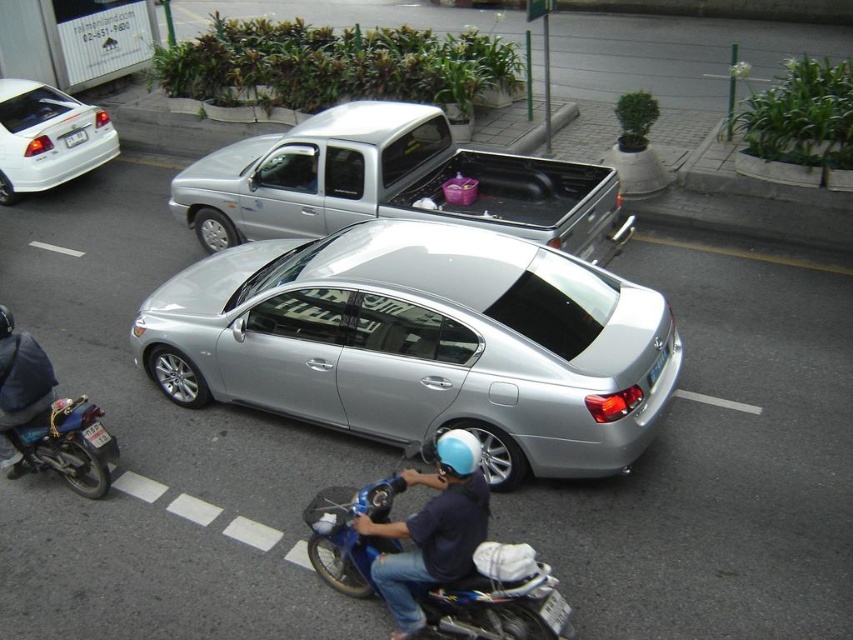
Is point (90, 118) farther from camera compared to point (84, 134)?

Yes.

Looking at this image, is white glossy sedan at upper left taller than white plastic license plate at upper left?

Yes, white glossy sedan at upper left is taller than white plastic license plate at upper left.

Who is more distant from viewer, (42, 168) or (77, 141)?

The point (77, 141) is more distant.

Identify the location of white glossy sedan at upper left. The width and height of the screenshot is (853, 640). (47, 138).

Based on the photo, which is more to the left, silver metallic sedan at center or blue metallic motorcycle at lower center?

Positioned to the left is blue metallic motorcycle at lower center.

Can you confirm if silver metallic sedan at center is thinner than blue metallic motorcycle at lower center?

Incorrect, silver metallic sedan at center's width is not less than blue metallic motorcycle at lower center's.

What are the coordinates of `silver metallic sedan at center` in the screenshot? It's located at (422, 342).

Which is above, blue matte helmet at center or silver metallic license plate at rear?

silver metallic license plate at rear is higher up.

What do you see at coordinates (432, 531) in the screenshot? I see `blue matte helmet at center` at bounding box center [432, 531].

Locate an element on the screen. Image resolution: width=853 pixels, height=640 pixels. blue matte helmet at center is located at coordinates (432, 531).